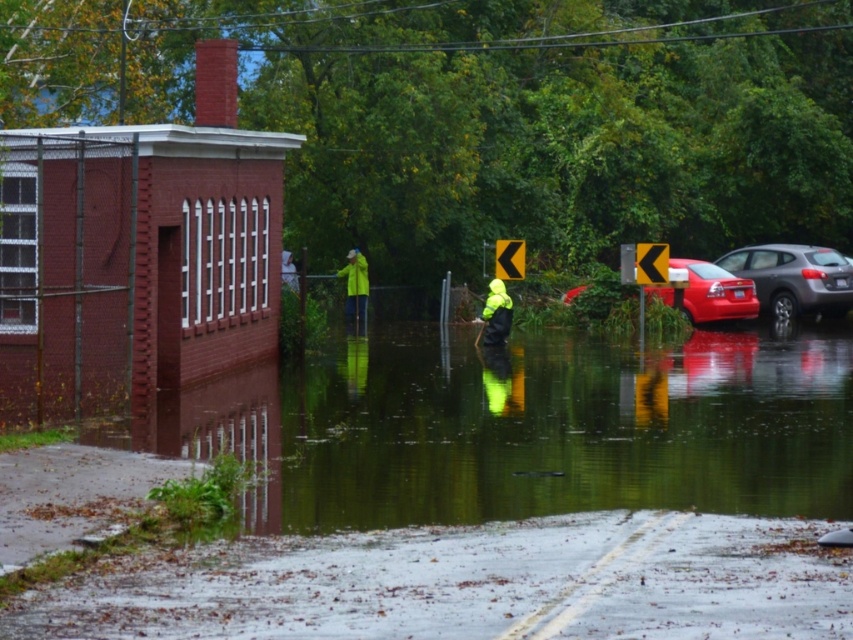
You are a delivery person needing to cross the flooded street. The shiny red sedan at center is blocking your path. Can you safely walk around it to reach the yellow waterproof jacket at center, which marks your destination? The maximum distance you can walk is 7 meters.

The shiny red sedan at center and yellow waterproof jacket at center are 6.92 meters apart from each other. Since the maximum distance you can walk is 7 meters, you can safely walk around the shiny red sedan at center to reach the yellow waterproof jacket at center.

You are a pedestrian trying to cross the flooded street. You see a shiny red sedan at center and a yellow waterproof jacket at center. Which object is shorter in height?

The shiny red sedan at center is shorter in height compared to the yellow waterproof jacket at center.